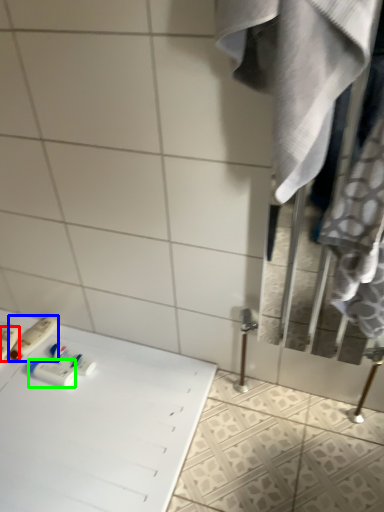
Question: Which object is positioned closest to toiletry (highlighted by a red box)? Select from toiletry (highlighted by a blue box) and toiletry (highlighted by a green box).

Choices:
 (A) toiletry
 (B) toiletry

Answer: (A)